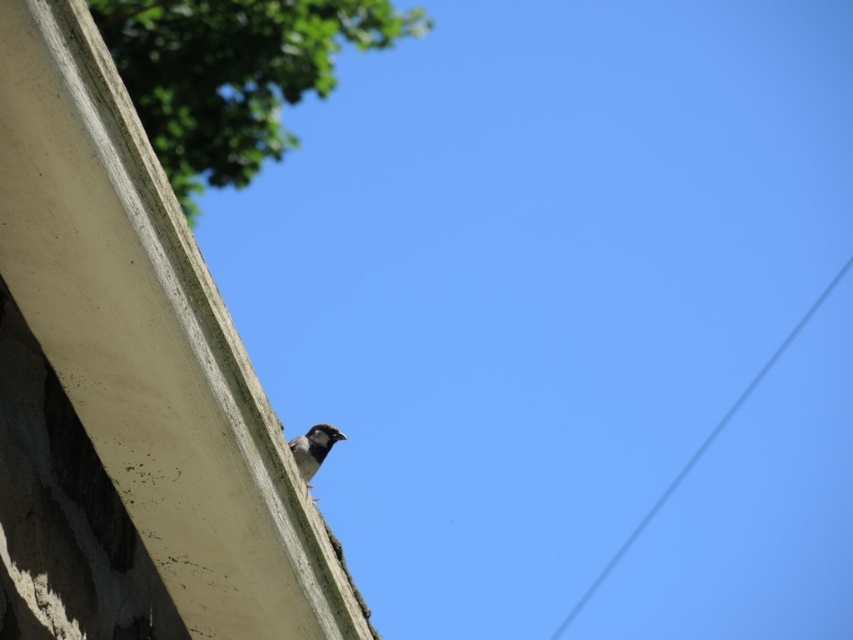
You are a photographer trying to capture the dark gray matte sparrow at upper center and the gray wire at upper right in the same frame. Based on their positions, which object is higher in the image?

The gray wire at upper right is taller than the dark gray matte sparrow at upper center, so the gray wire at upper right is higher in the image.

You are a birdwatcher trying to photograph the dark gray matte sparrow at upper center and the green leafy tree at upper left. Which object is closer to the camera?

The green leafy tree at upper left is closer to the camera because the dark gray matte sparrow at upper center is positioned behind it.